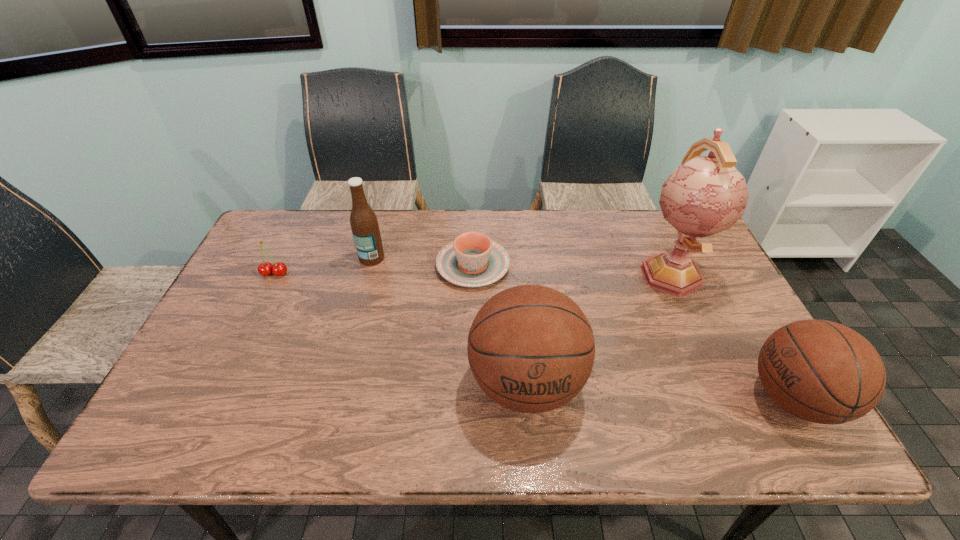
Locate an element on the screen. This screenshot has height=540, width=960. free space located on the side with brand label of the shorter basketball is located at coordinates (690, 398).

Find the location of `vacant region located 0.050m on the handle side of the shortest object`. vacant region located 0.050m on the handle side of the shortest object is located at coordinates (473, 233).

At what (x,y) coordinates should I click in order to perform the action: click on vacant space located 0.080m on the handle side of the shortest object. Please return your answer as a coordinate pair (x, y). Looking at the image, I should click on (473, 227).

The height and width of the screenshot is (540, 960). In order to click on vacant space situated 0.130m on the handle side of the shortest object in this screenshot , I will do `click(474, 218)`.

The height and width of the screenshot is (540, 960). What are the coordinates of `free point located on the front-facing side of the globe` in the screenshot? It's located at (722, 389).

Image resolution: width=960 pixels, height=540 pixels. Identify the location of vacant space located on the right of the beer bottle. (477, 258).

You are a GUI agent. You are given a task and a screenshot of the screen. Output one action in this format:
    pyautogui.click(x=<x>, y=<y>)
    Task: Click on the blank space located 0.060m with the stems of the cherry pointing upwards
    The height and width of the screenshot is (540, 960).
    Given the screenshot: What is the action you would take?
    pos(265,294)

I want to click on chinaware present at the far edge, so click(472, 260).

Find the location of a particular element. The width and height of the screenshot is (960, 540). globe located in the far edge section of the desktop is located at coordinates (705, 195).

Where is `beer bottle located at the far edge`? beer bottle located at the far edge is located at coordinates (364, 224).